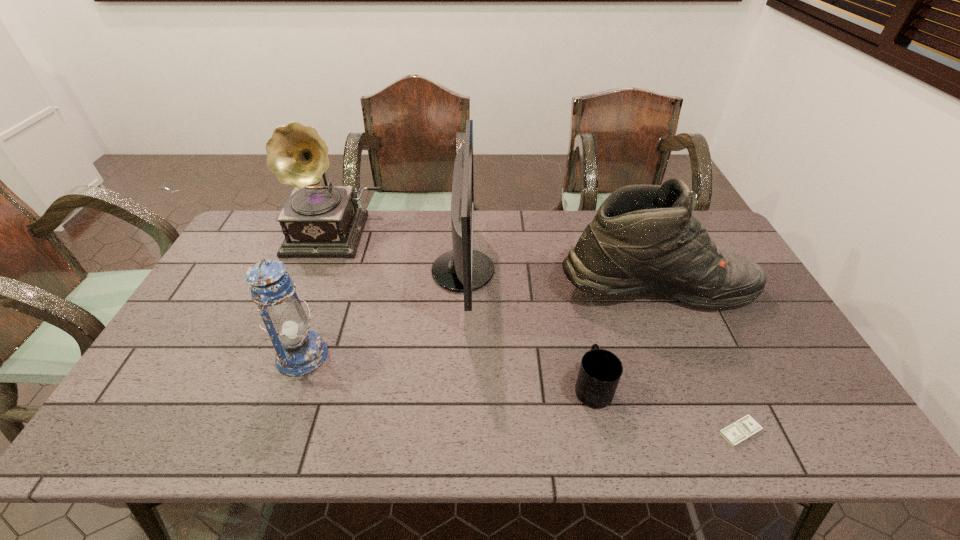
You are a GUI agent. You are given a task and a screenshot of the screen. Output one action in this format:
    pyautogui.click(x=<x>, y=<y>)
    Task: Click on the free space at the near edge of the desktop
    
    Given the screenshot: What is the action you would take?
    pyautogui.click(x=266, y=429)

I want to click on vacant space at the right edge, so click(x=766, y=306).

Find the location of a particular element. vacant position at the near right corner of the desktop is located at coordinates (829, 442).

Where is `vacant area that lies between the lantern and the fifth tallest object`? The height and width of the screenshot is (540, 960). vacant area that lies between the lantern and the fifth tallest object is located at coordinates pos(447,372).

Where is `empty space that is in between the mug and the lantern`? The height and width of the screenshot is (540, 960). empty space that is in between the mug and the lantern is located at coordinates (447, 372).

This screenshot has width=960, height=540. What are the coordinates of `free space between the ski boot and the monitor` in the screenshot? It's located at (559, 279).

The width and height of the screenshot is (960, 540). In order to click on vacant space that's between the record player and the nearest object in this screenshot , I will do `click(538, 333)`.

Locate an element on the screen. Image resolution: width=960 pixels, height=540 pixels. free point between the ski boot and the record player is located at coordinates (495, 260).

At what (x,y) coordinates should I click in order to perform the action: click on vacant space in between the ski boot and the lantern. Please return your answer as a coordinate pair (x, y). The image size is (960, 540). Looking at the image, I should click on (478, 321).

Identify the location of free space between the lantern and the nearest object. point(520,394).